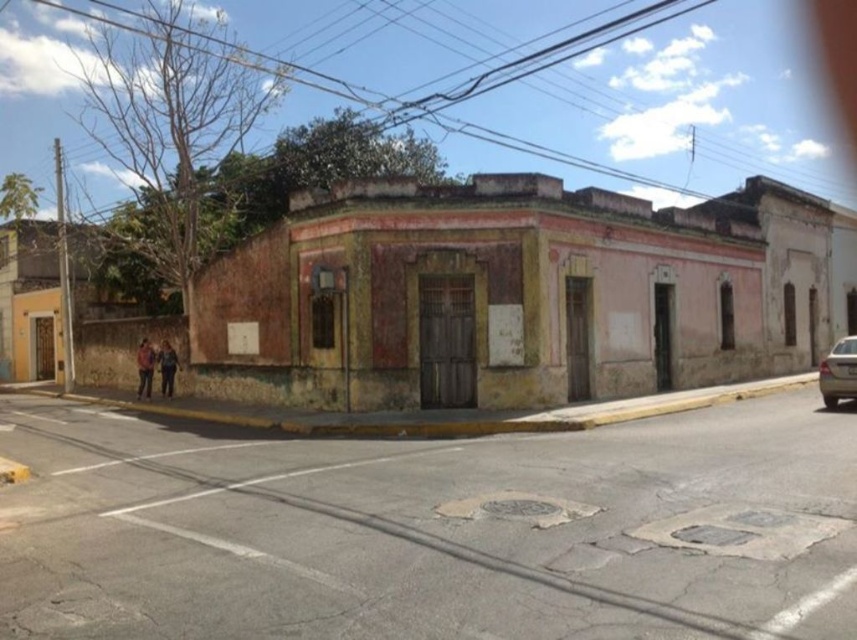
Is orange fabric jacket at lower left shorter than dark blue jeans at lower left?

Incorrect, orange fabric jacket at lower left's height does not fall short of dark blue jeans at lower left's.

Is point (136, 369) behind point (165, 358)?

Yes, it is behind point (165, 358).

You are a GUI agent. You are given a task and a screenshot of the screen. Output one action in this format:
    pyautogui.click(x=<x>, y=<y>)
    Task: Click on the orange fabric jacket at lower left
    The image size is (857, 640).
    Given the screenshot: What is the action you would take?
    pyautogui.click(x=144, y=368)

Between gold metallic car at right and dark blue jeans at lower left, which one is positioned lower?

dark blue jeans at lower left is below.

Is point (837, 356) positioned before point (172, 390)?

Yes, point (837, 356) is in front of point (172, 390).

Is point (855, 387) positioned before point (172, 392)?

Yes, it is in front of point (172, 392).

What are the coordinates of `gold metallic car at right` in the screenshot? It's located at (838, 372).

Does point (841, 381) lie in front of point (147, 388)?

Yes, point (841, 381) is closer to viewer.

Image resolution: width=857 pixels, height=640 pixels. Describe the element at coordinates (838, 372) in the screenshot. I see `gold metallic car at right` at that location.

Where is `gold metallic car at right`? Image resolution: width=857 pixels, height=640 pixels. gold metallic car at right is located at coordinates click(x=838, y=372).